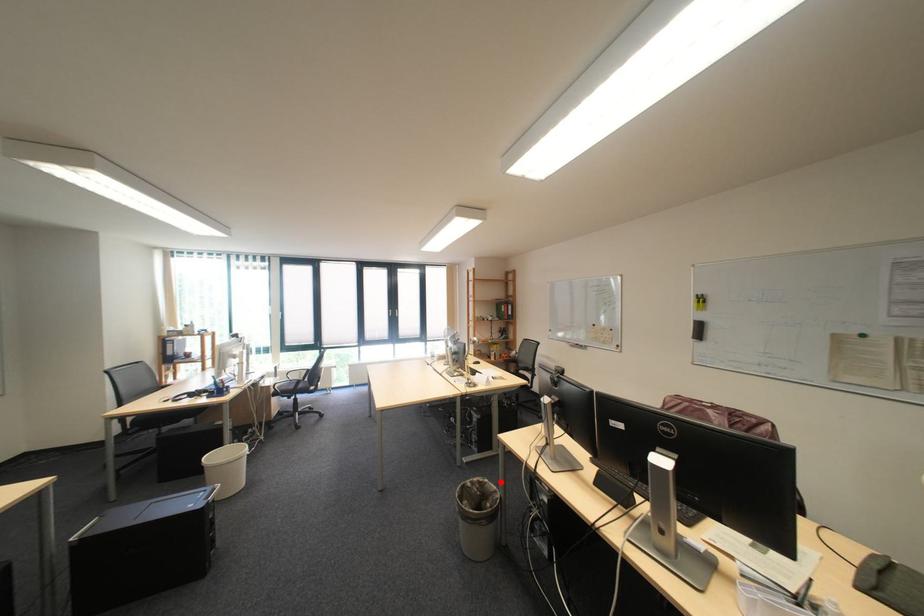
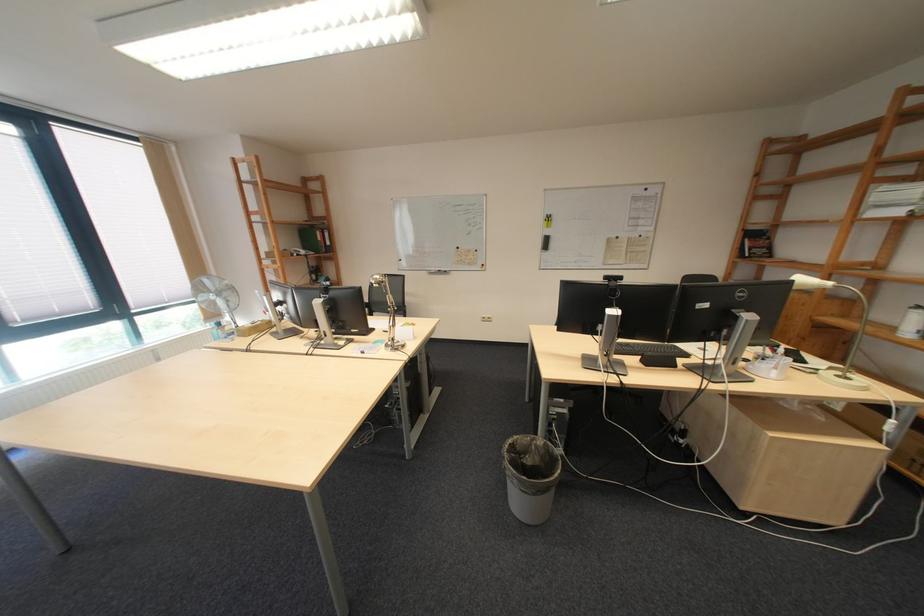
In the second image, find the point that corresponds to the highlighted location in the first image.

(529, 439)